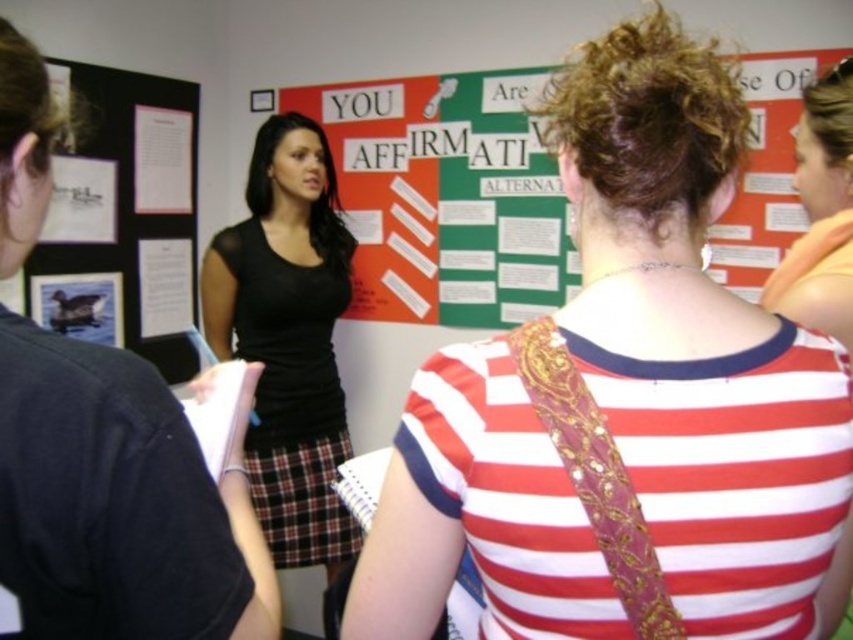
Can you confirm if green paper poster at center is positioned to the right of black mesh top at center?

Correct, you'll find green paper poster at center to the right of black mesh top at center.

Between point (497, 230) and point (279, 461), which one is positioned in front?

Point (279, 461) is more forward.

At what (x,y) coordinates should I click in order to perform the action: click on green paper poster at center. Please return your answer as a coordinate pair (x, y). The image size is (853, 640). Looking at the image, I should click on (445, 196).

What are the coordinates of `green paper poster at center` in the screenshot? It's located at (445, 196).

Is white striped shirt at center bigger than black mesh top at center?

Actually, white striped shirt at center might be smaller than black mesh top at center.

Based on the photo, who is more distant from viewer, (628, 436) or (331, 240)?

Positioned behind is point (331, 240).

This screenshot has width=853, height=640. I want to click on white striped shirt at center, so click(697, 346).

Who is higher up, black mesh top at center or orange fabric shirt at upper right?

orange fabric shirt at upper right is higher up.

Is black mesh top at center in front of orange fabric shirt at upper right?

No.

Locate an element on the screen. The image size is (853, 640). black mesh top at center is located at coordinates (288, 339).